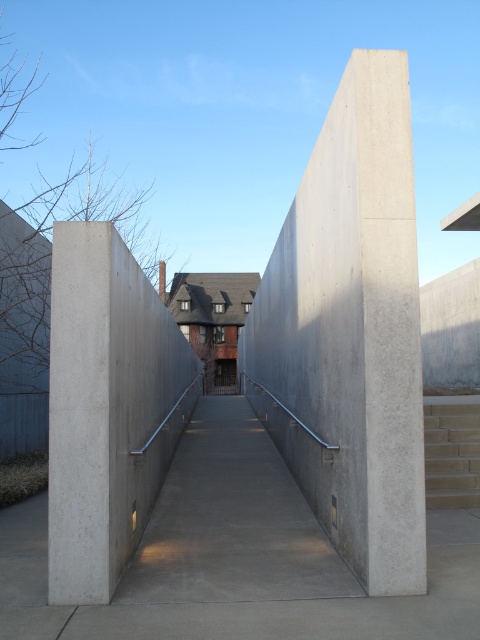
Based on the photo, you are a pedestrian walking along the pathway between the smooth concrete wall at center and the smooth concrete pillar at center. Which object is closer to your left side as you face the pathway ahead?

The smooth concrete pillar at center is closer to your left side because the smooth concrete wall at center is positioned to its right.

You are a delivery person trying to deliver a package to the traditional house in the background. You are standing at the point marked as point (231, 522). The path between the two concrete walls is narrow. Can you navigate through the ramp at center to reach the house?

The point (231, 522) is located on the smooth concrete ramp at center, so yes, you can navigate through the ramp at center to reach the traditional house in the background as it is part of the pathway leading towards the house.

You are standing at the entrance of the pathway between the two concrete walls. You notice two points marked on the scene. One is at coordinate point (201, 492) and the other at point (446, 500). Which point is closer to you as you face the pathway?

Point (201, 492) is closer to you because it is further to the viewer than point (446, 500).